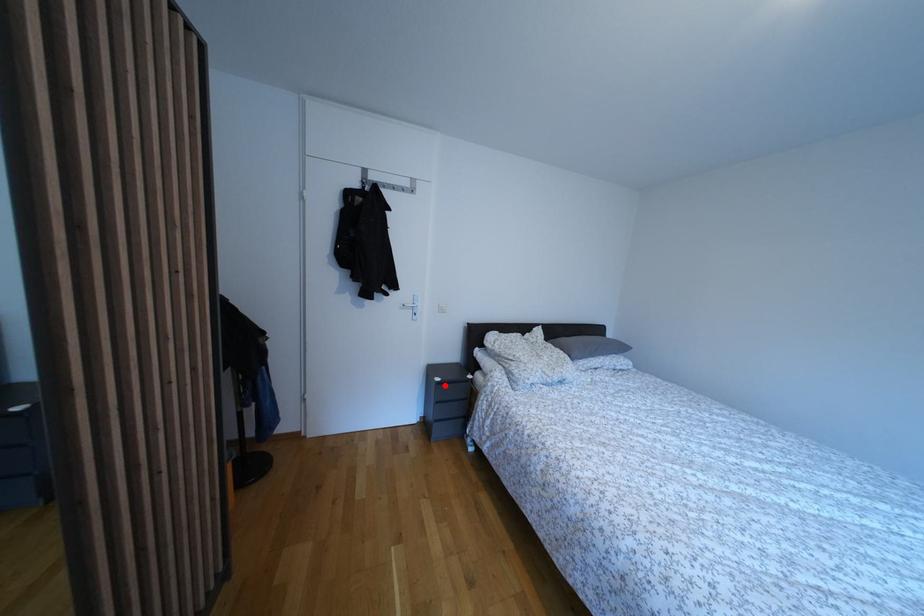
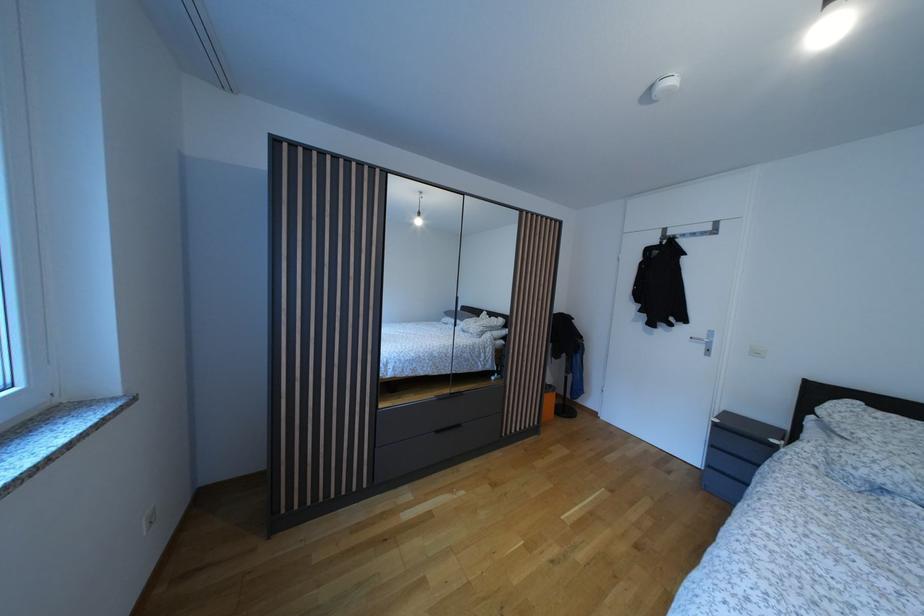
Question: I am providing you with two images of the same scene from different viewpoints. Given a red point in image1, look at the same physical point in image2. Is it:

Choices:
 (A) Closer to the viewpoint
 (B) Farther from the viewpoint

Answer: (A)